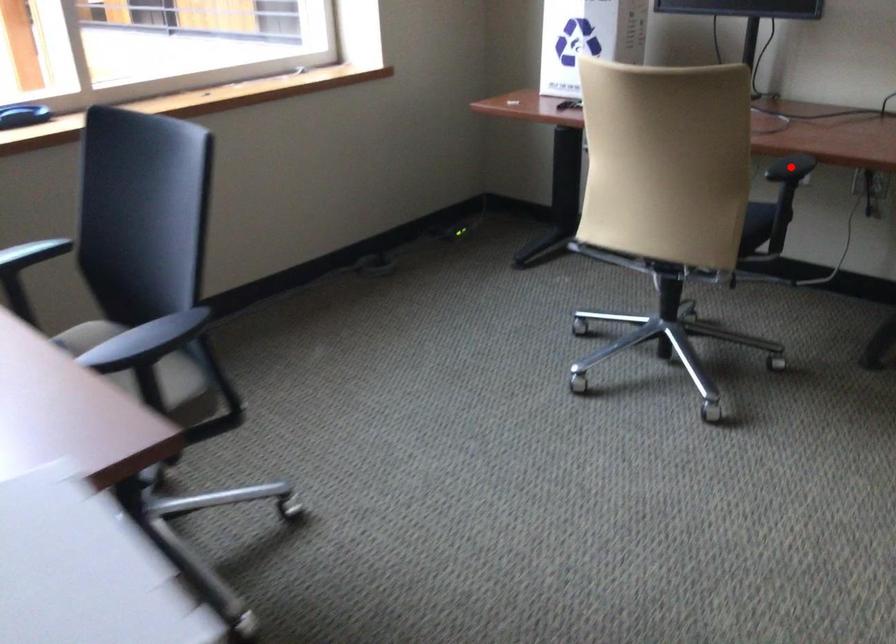
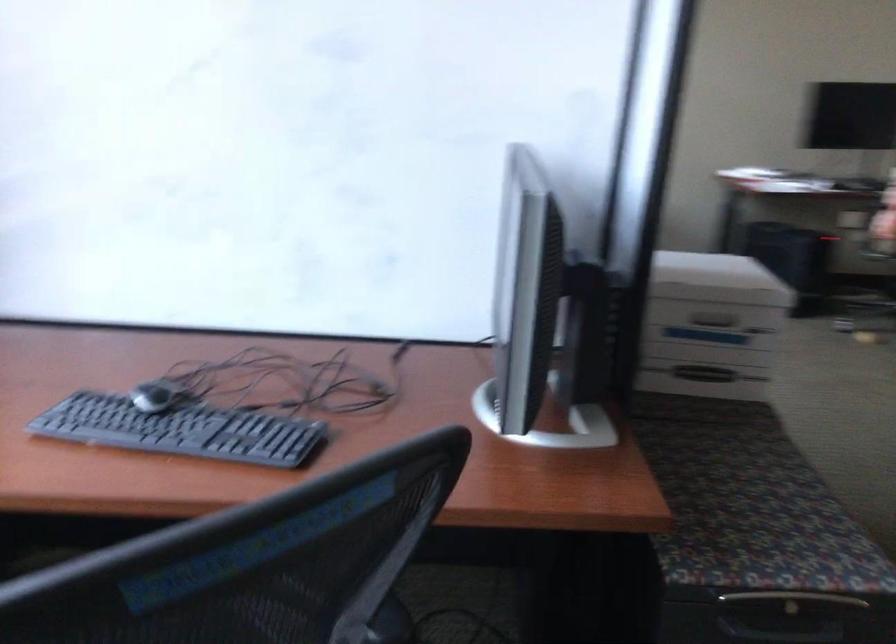
Question: I am providing you with two images of the same scene from different viewpoints. A red point is marked on the first image. At the location where the point appears in image 1, is it still visible in image 2?

Choices:
 (A) Yes
 (B) No

Answer: (B)